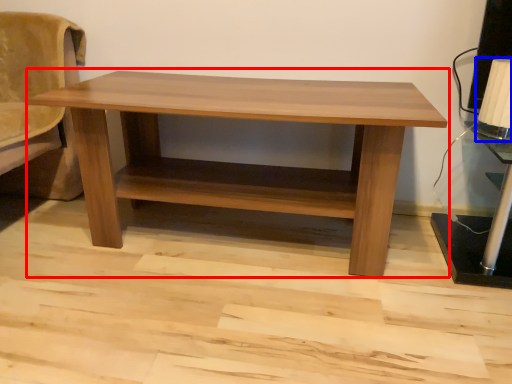
Question: Which object appears farthest to the camera in this image, table (highlighted by a red box) or table lamp (highlighted by a blue box)?

Choices:
 (A) table
 (B) table lamp

Answer: (B)